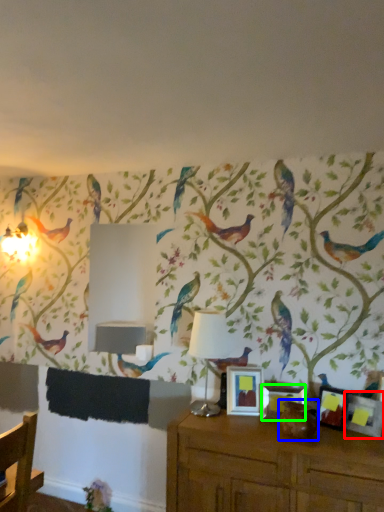
Question: Estimate the real-world distances between objects in this image. Which object is farther from picture frame (highlighted by a red box), animal (highlighted by a blue box) or picture frame (highlighted by a green box)?

Choices:
 (A) animal
 (B) picture frame

Answer: (B)